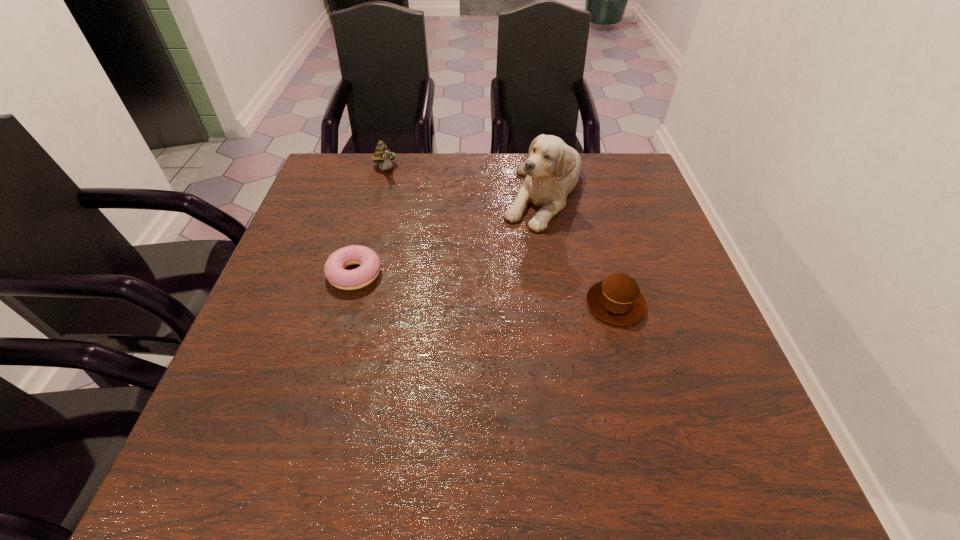
Where is `vacant space at the left edge of the desktop`? vacant space at the left edge of the desktop is located at coordinates (348, 201).

The height and width of the screenshot is (540, 960). In order to click on vacant area at the right edge in this screenshot , I will do `click(706, 373)`.

In the image, there is a desktop. Where is `vacant space at the far left corner`? The width and height of the screenshot is (960, 540). vacant space at the far left corner is located at coordinates (350, 169).

I want to click on vacant area at the near left corner of the desktop, so click(293, 414).

You are a GUI agent. You are given a task and a screenshot of the screen. Output one action in this format:
    pyautogui.click(x=<x>, y=<y>)
    Task: Click on the free spot at the far right corner of the desktop
    The width and height of the screenshot is (960, 540).
    Given the screenshot: What is the action you would take?
    pyautogui.click(x=636, y=175)

At what (x,y) coordinates should I click in order to perform the action: click on free space between the snail and the muffin. Please return your answer as a coordinate pair (x, y). Looking at the image, I should click on (501, 237).

Where is `vacant space that's between the snail and the shortest object`? vacant space that's between the snail and the shortest object is located at coordinates (370, 222).

At what (x,y) coordinates should I click in order to perform the action: click on unoccupied position between the muffin and the tallest object. Please return your answer as a coordinate pair (x, y). Looking at the image, I should click on click(580, 247).

At what (x,y) coordinates should I click in order to perform the action: click on empty location between the shortest object and the tallest object. Please return your answer as a coordinate pair (x, y). This screenshot has width=960, height=540. Looking at the image, I should click on [449, 232].

Identify the location of free space between the puppy and the doughnut. point(449,232).